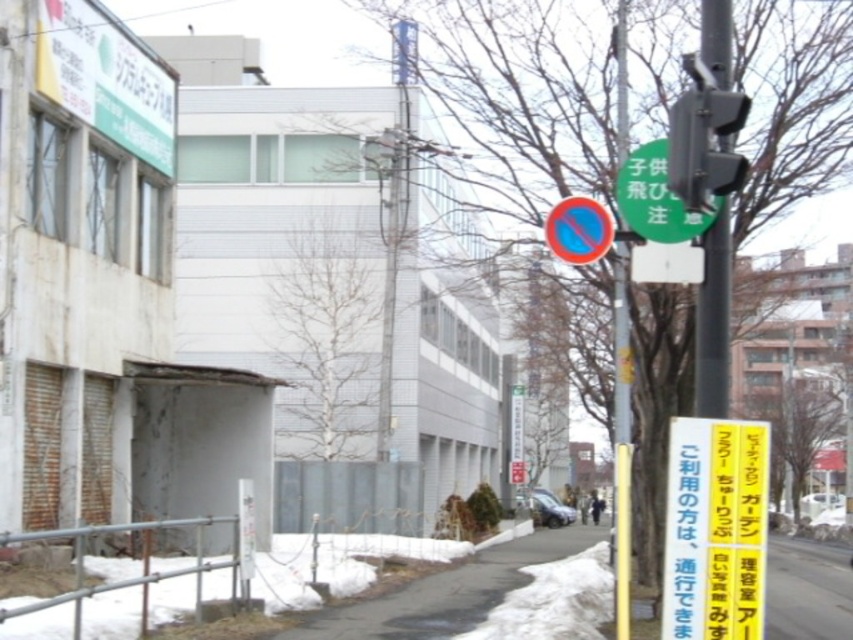
You are a pedestrian standing on the black asphalt pavement at lower center and want to pick up the yellow paper sign at lower right. Is the sign within your immediate reach without moving your feet?

The yellow paper sign at lower right is closer to the viewer than the black asphalt pavement at lower center, so yes, the sign is within immediate reach without moving your feet.

You are standing at the center of the image and want to walk to the black asphalt pavement at lower center. According to the coordinates provided, in which direction should you move relative to your current position?

The black asphalt pavement at lower center is located at coordinates point (447, 593), which means you should move downward and to the right from your current position at the center to reach it.

You are a pedestrian standing on the black asphalt pavement at lower center and want to read the yellow paper sign at lower right. Is the sign large enough to read clearly from your current position?

The yellow paper sign at lower right is smaller than the black asphalt pavement at lower center. Since the sign is smaller, it might be difficult to read clearly from your current position on the black asphalt pavement at lower center.